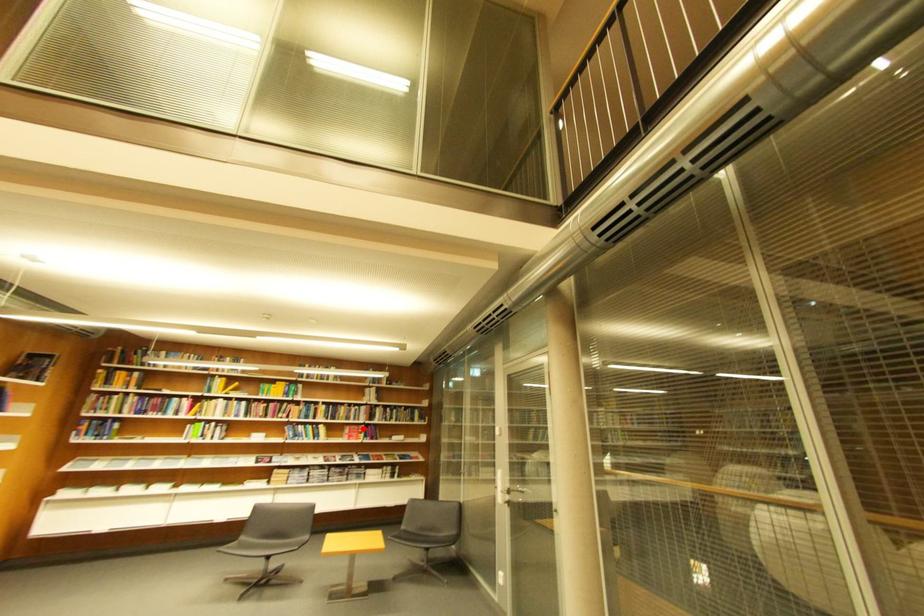
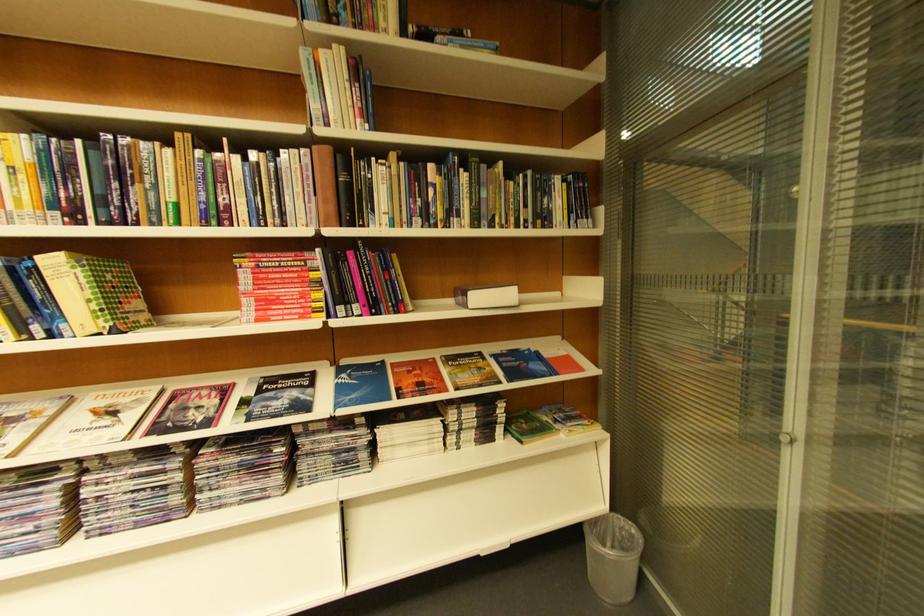
Question: I am providing you with two images of the same scene from different viewpoints. Given a red point in image1, look at the same physical point in image2. Is it:

Choices:
 (A) Closer to the viewpoint
 (B) Farther from the viewpoint

Answer: (A)